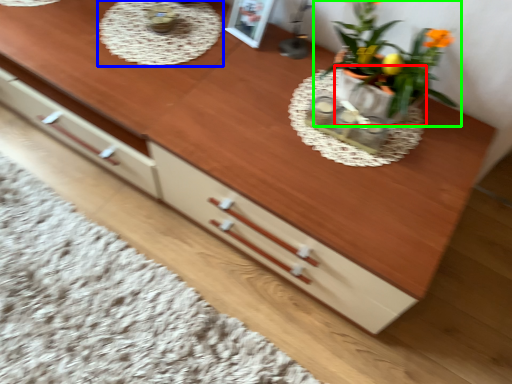
Question: Based on their relative distances, which object is farther from flowerpot (highlighted by a red box)? Choose from round table (highlighted by a blue box) and houseplant (highlighted by a green box).

Choices:
 (A) round table
 (B) houseplant

Answer: (A)